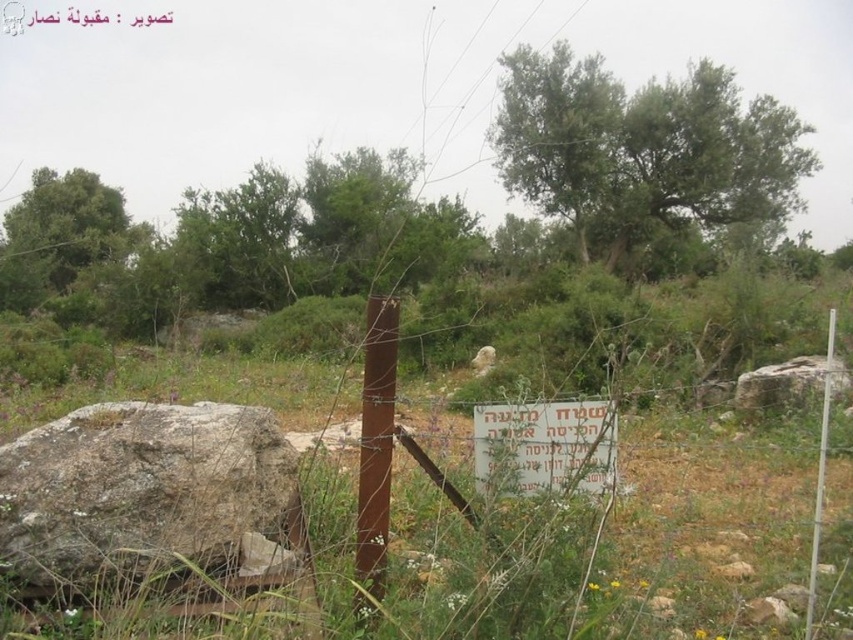
Consider the image. You are a photographer setting up equipment in the rural area shown. You need to place a tripod between the rusty metal pole at center and the white plastic pole at right. Since you want the tripod to be as close as possible to the viewer, which pole should you position it near?

The tripod should be placed near the rusty metal pole at center because it is closer to the viewer compared to the white plastic pole at right.

You are a hiker who needs to read the white plastic sign at center. Since the rusty metal pole at center is in your way, can you move around it to get a clear view?

The white plastic sign at center is located above the rusty metal pole at center, so you can move around the pole to see the sign clearly as it is positioned above it.